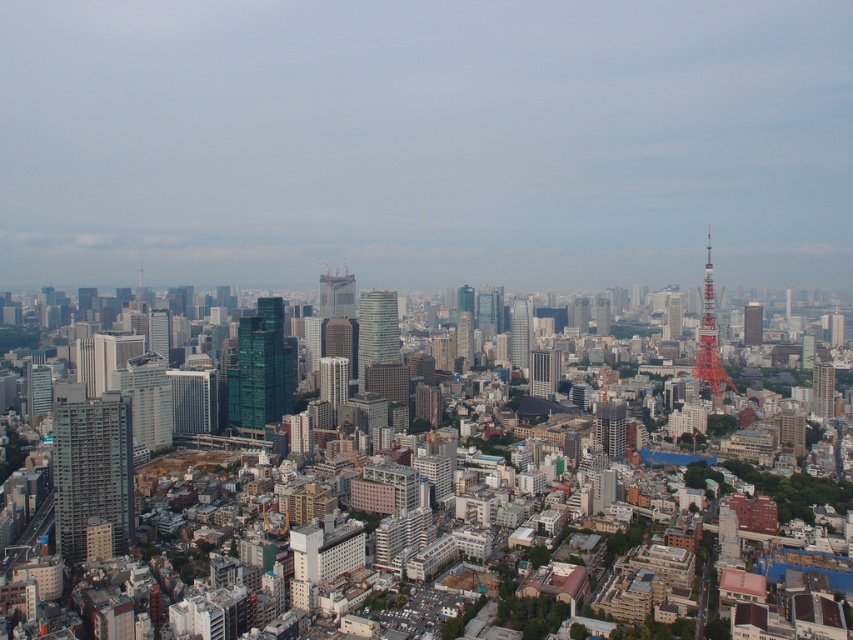
Question: Which of the following is the closest to the observer?

Choices:
 (A) (461, 326)
 (B) (811, 396)

Answer: (B)

Question: Which object is closer to the camera taking this photo?

Choices:
 (A) orange metallic tokyo tower at right
 (B) matte glass skyscraper at center-left
 (C) metallic glass building at left
 (D) red glass tower at right

Answer: (C)

Question: Can you confirm if metallic glass building at left is wider than reddish-brown metallic tower at right?

Choices:
 (A) no
 (B) yes

Answer: (B)

Question: Which object appears closest to the camera in this image?

Choices:
 (A) green glass skyscraper at center
 (B) red glass tower at right
 (C) reddish-brown metallic tower at right
 (D) metallic glass building at left

Answer: (D)

Question: Does metallic glass building at left have a greater width compared to shiny glass skyscraper at center?

Choices:
 (A) no
 (B) yes

Answer: (B)

Question: Is metallic glass building at left bigger than reddish-brown metallic tower at right?

Choices:
 (A) no
 (B) yes

Answer: (B)